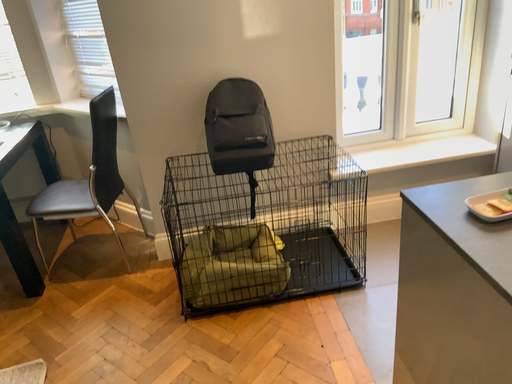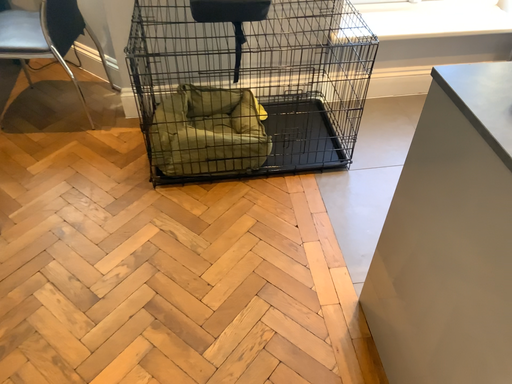
Question: Which way did the camera rotate in the video?

Choices:
 (A) rotated downward
 (B) rotated upward

Answer: (A)